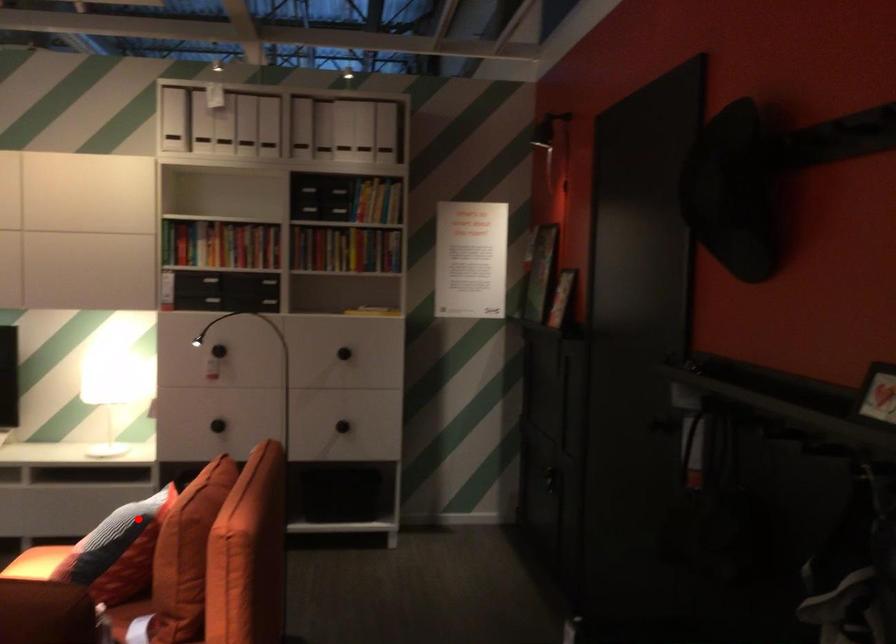
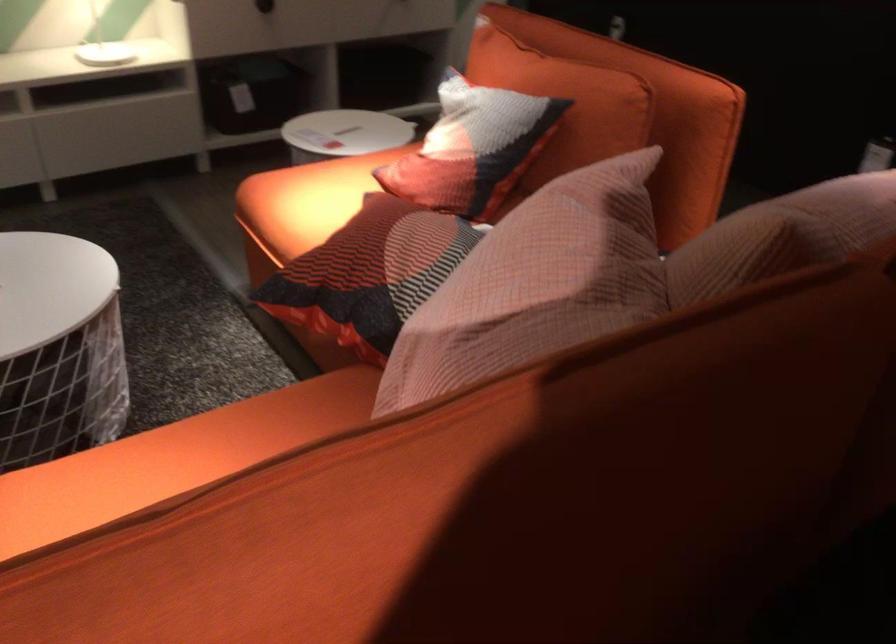
Where in the second image is the point corresponding to the highlighted location from the first image?

(564, 102)